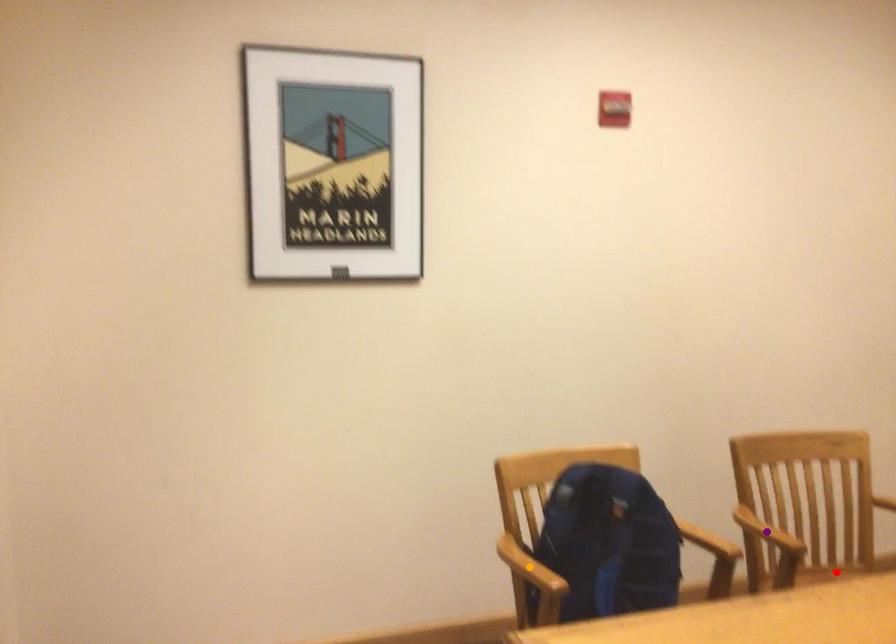
Order these from farthest to nearest:
purple point, orange point, red point

red point → purple point → orange point